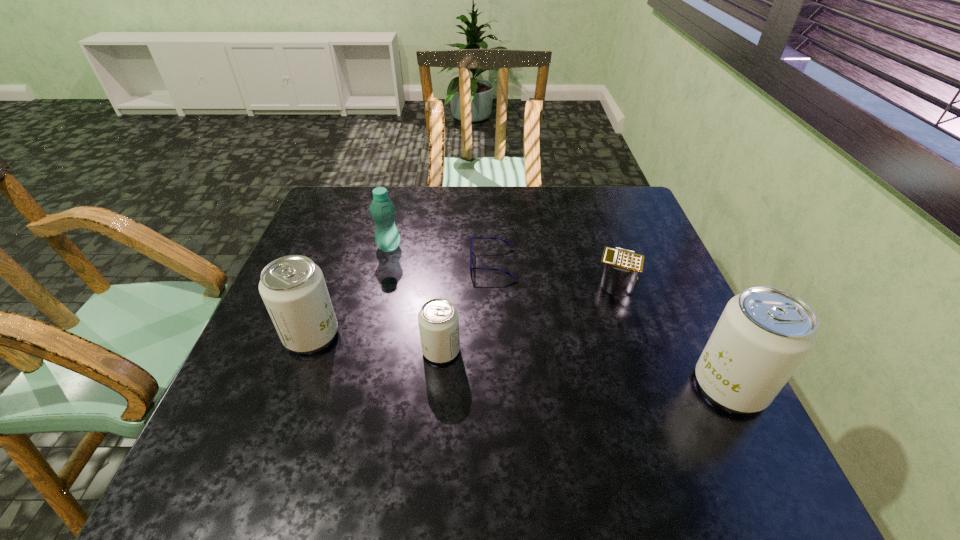
In order to click on soda can situated at the right edge in this screenshot , I will do `click(764, 333)`.

You are a GUI agent. You are given a task and a screenshot of the screen. Output one action in this format:
    pyautogui.click(x=<x>, y=<y>)
    Task: Click on the calculator situated at the right edge
    
    Given the screenshot: What is the action you would take?
    pyautogui.click(x=622, y=266)

Where is `object that is at the near right corner`? This screenshot has width=960, height=540. object that is at the near right corner is located at coordinates (764, 333).

Where is `vacant space at the far edge`? vacant space at the far edge is located at coordinates (454, 197).

The image size is (960, 540). In the image, there is a desktop. Identify the location of vacant space at the near edge. (651, 414).

In the image, there is a desktop. Identify the location of vacant space at the left edge. The image size is (960, 540). click(x=266, y=394).

In the image, there is a desktop. In order to click on vacant space at the right edge in this screenshot , I will do [679, 318].

The height and width of the screenshot is (540, 960). I want to click on vacant space that is in between the leftmost object and the second shortest object, so click(464, 308).

Find the location of a particular element. The image size is (960, 540). vacant space in between the third object from right to left and the second shortest soda can is located at coordinates (402, 299).

You are a GUI agent. You are given a task and a screenshot of the screen. Output one action in this format:
    pyautogui.click(x=<x>, y=<y>)
    Task: Click on the vacant region between the second shortest soda can and the shortest object
    The image size is (960, 540).
    Given the screenshot: What is the action you would take?
    pyautogui.click(x=402, y=299)